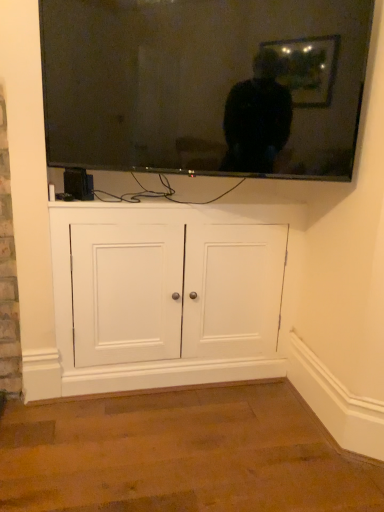
Question: Looking at the image, does flat screen tv at upper center seem bigger or smaller compared to white wood cabinet at center?

Choices:
 (A) small
 (B) big

Answer: (A)

Question: Relative to white wood cabinet at center, is flat screen tv at upper center in front or behind?

Choices:
 (A) front
 (B) behind

Answer: (A)

Question: Is flat screen tv at upper center wider or thinner than white wood cabinet at center?

Choices:
 (A) thin
 (B) wide

Answer: (A)

Question: Based on their sizes in the image, would you say white wood cabinet at center is bigger or smaller than flat screen tv at upper center?

Choices:
 (A) small
 (B) big

Answer: (B)

Question: Based on their positions, is white wood cabinet at center located to the left or right of flat screen tv at upper center?

Choices:
 (A) right
 (B) left

Answer: (B)

Question: Choose the correct answer: Is white wood cabinet at center inside flat screen tv at upper center or outside it?

Choices:
 (A) outside
 (B) inside

Answer: (A)

Question: From the image's perspective, is white wood cabinet at center above or below flat screen tv at upper center?

Choices:
 (A) below
 (B) above

Answer: (A)